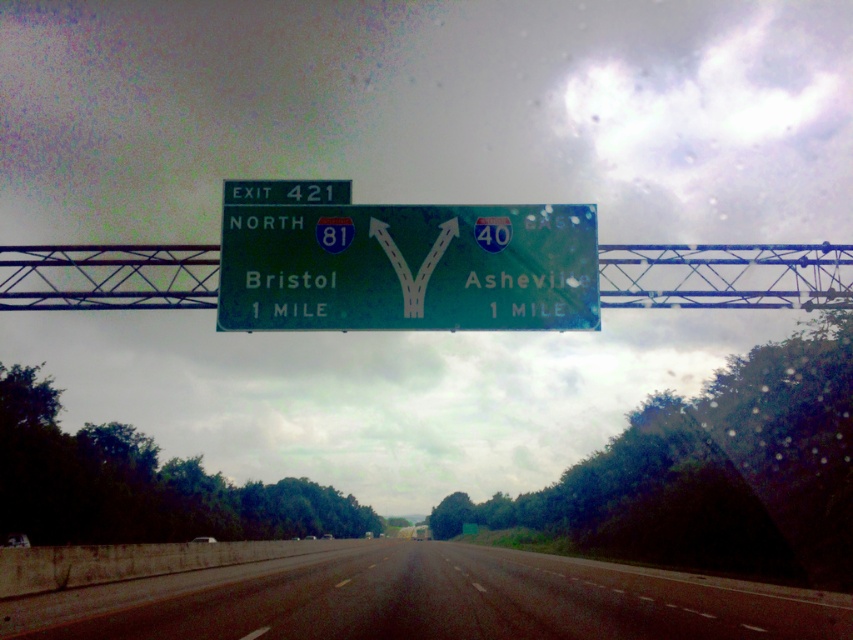
Question: Which point is farther to the camera?

Choices:
 (A) (556, 598)
 (B) (579, 308)

Answer: (A)

Question: Does black asphalt highway at center come in front of green glossy sign at center?

Choices:
 (A) yes
 (B) no

Answer: (A)

Question: Is black asphalt highway at center smaller than green glossy sign at center?

Choices:
 (A) no
 (B) yes

Answer: (A)

Question: Can you confirm if black asphalt highway at center is positioned above green glossy sign at center?

Choices:
 (A) yes
 (B) no

Answer: (B)